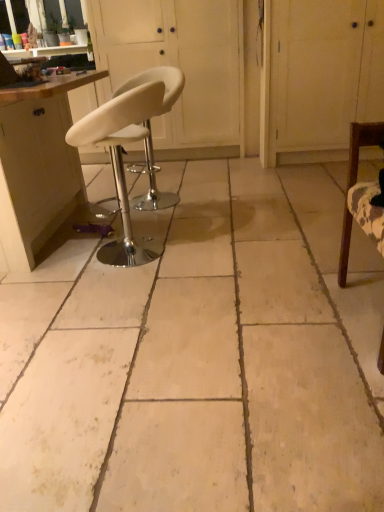
Find the location of a particular element. Image resolution: width=384 pixels, height=512 pixels. vacant space underneath white leather stool at center, the third chair positioned from the front (from a real-world perspective) is located at coordinates (171, 198).